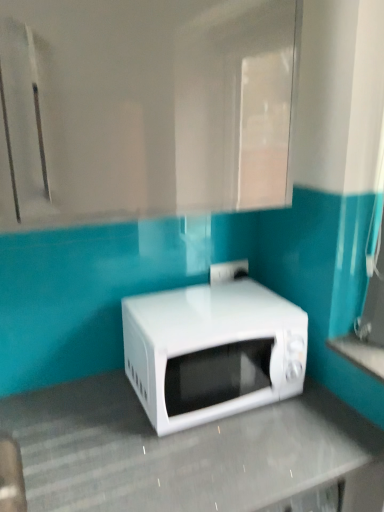
Question: Is white glossy countertop at lower right, the first counter top when ordered from top to bottom, spatially inside white glossy microwave at center, the 2th counter top when ordered from right to left, or outside of it?

Choices:
 (A) inside
 (B) outside

Answer: (B)

Question: Considering the positions of white glossy countertop at lower right, which is counted as the 1th counter top, starting from the right, and white glossy microwave at center, arranged as the 1th counter top when viewed from the left, in the image, is white glossy countertop at lower right, which is counted as the 1th counter top, starting from the right, bigger or smaller than white glossy microwave at center, arranged as the 1th counter top when viewed from the left,?

Choices:
 (A) small
 (B) big

Answer: (A)

Question: Based on their relative distances, which object is nearer to the white glossy countertop at lower right, the first counter top when ordered from top to bottom?

Choices:
 (A) white glossy microwave at center, the 2th counter top when ordered from right to left
 (B) white glossy microwave at center

Answer: (B)

Question: Which object is positioned closest to the white glossy microwave at center?

Choices:
 (A) white glossy countertop at lower right, which is counted as the 1th counter top, starting from the right
 (B) white glossy microwave at center, placed as the 2th counter top when sorted from top to bottom

Answer: (B)